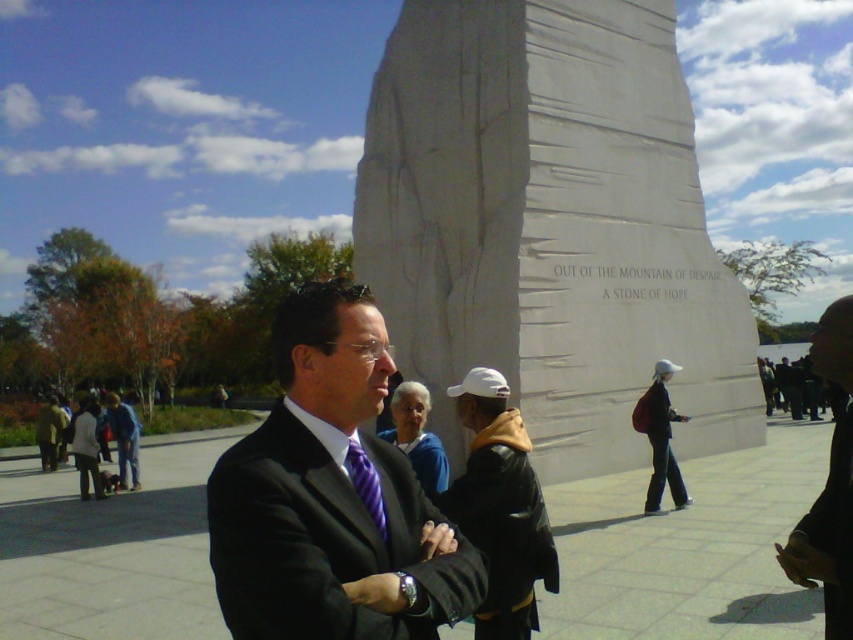
Based on the photo, you are a photographer trying to capture both the black suit at center and the dark suit at center in a single frame. Which suit should you focus on first to ensure it appears larger in the photo?

The black suit at center is taller than the dark suit at center, so focusing on the black suit at center first will ensure it appears larger in the photo.

You are standing in front of a large stone monument. You see a white matte baseball cap at center and a dark suit at center. Which object is positioned to the left?

The white matte baseball cap at center is to the left of the dark suit at center.

You are standing at the point labeled point (469, 458) and want to walk to the point labeled point (782, 564). Which direction should you face to move towards your destination?

To move from point 0.716, 0552 to point (782, 564), you should face northeast because point (782, 564) is northeast of point (469, 458).